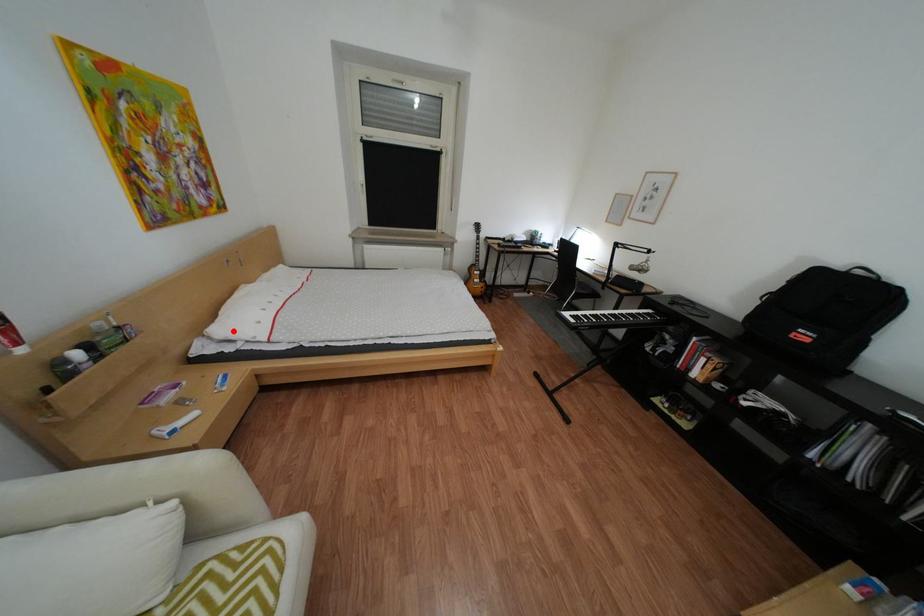
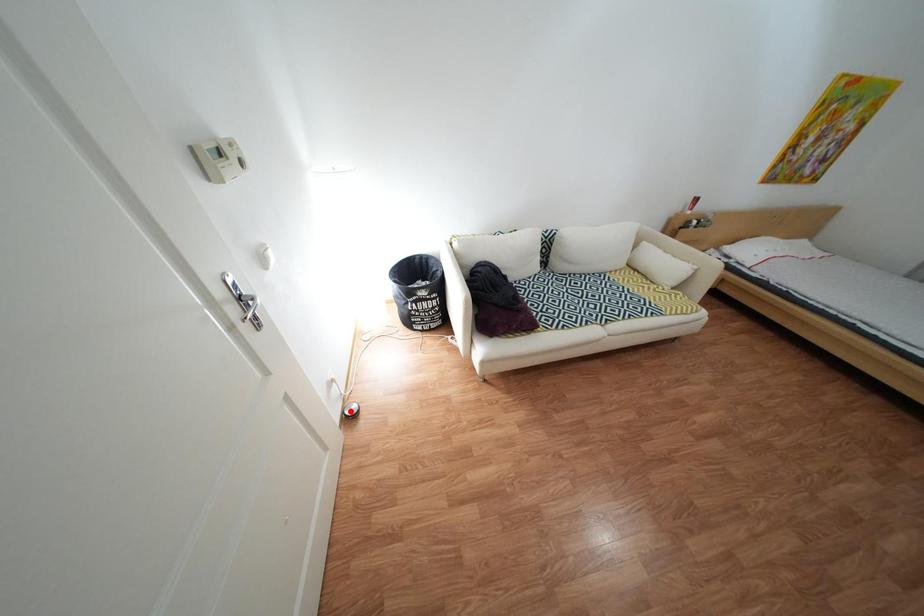
I am providing you with two images of the same scene from different viewpoints. A red point is marked on the first image and another point is marked on the second image. Does the point marked in image1 correspond to the same location as the one in image2?

No